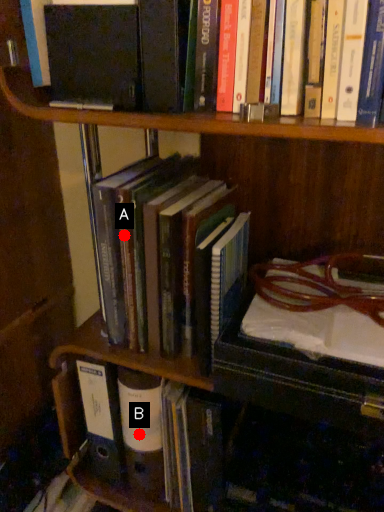
Question: Two points are circled on the image, labeled by A and B beside each circle. Which point is further to the camera?

Choices:
 (A) A is further
 (B) B is further

Answer: (B)